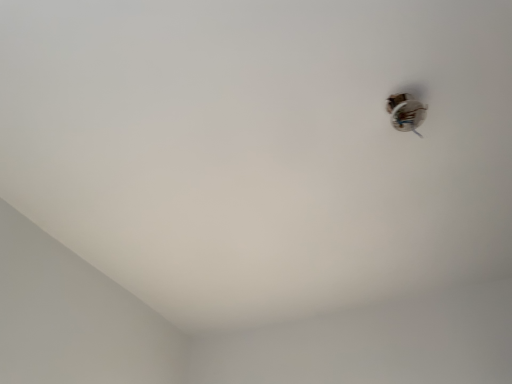
Measure the distance between point [412,122] and camera.

Point [412,122] is 3.46 feet from camera.

Describe the element at coordinates (405, 113) in the screenshot. This screenshot has height=384, width=512. I see `metallic wire at upper right` at that location.

The height and width of the screenshot is (384, 512). What are the coordinates of `metallic wire at upper right` in the screenshot? It's located at (405, 113).

In order to face metallic wire at upper right, should I rotate leftwards or rightwards?

A 19.522 degree turn to the right will do.

Locate an element on the screen. metallic wire at upper right is located at coordinates (405, 113).